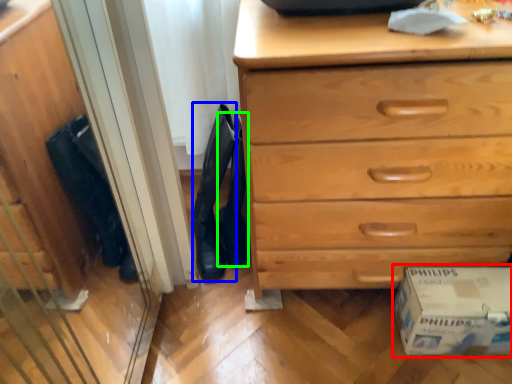
Question: Considering the real-world distances, which object is farthest from cardboard box (highlighted by a red box)? boot (highlighted by a blue box) or shoe (highlighted by a green box)?

Choices:
 (A) boot
 (B) shoe

Answer: (A)